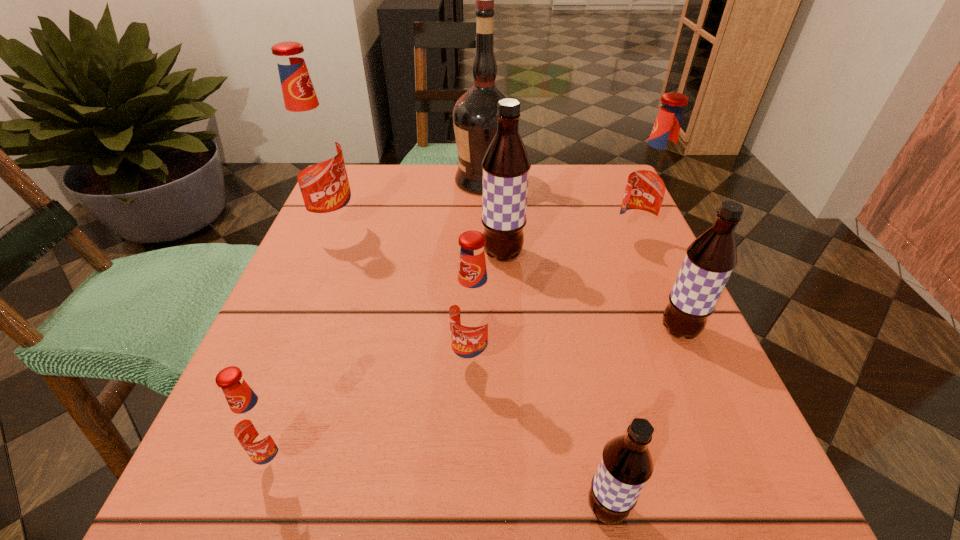
Locate an element on the screen. This screenshot has width=960, height=540. the farthest object is located at coordinates 474,115.

The width and height of the screenshot is (960, 540). What are the coordinates of `the tallest root beer` in the screenshot? It's located at (314, 153).

You are a GUI agent. You are given a task and a screenshot of the screen. Output one action in this format:
    pyautogui.click(x=<x>, y=<y>)
    Task: Click on the third smallest red root beer
    
    Given the screenshot: What is the action you would take?
    pyautogui.click(x=651, y=182)

Where is `the leftmost brown root beer`? the leftmost brown root beer is located at coordinates (506, 165).

The image size is (960, 540). What are the coordinates of `the biggest brown root beer` in the screenshot? It's located at (506, 165).

I want to click on the rightmost brown root beer, so click(710, 259).

Where is `the second smallest brown root beer`? The width and height of the screenshot is (960, 540). the second smallest brown root beer is located at coordinates (710, 259).

Locate an element on the screen. This screenshot has width=960, height=540. the second nearest red root beer is located at coordinates coord(473,309).

Locate an element on the screen. The image size is (960, 540). the second smallest red root beer is located at coordinates (473, 309).

Locate an element on the screen. This screenshot has width=960, height=540. the sixth farthest root beer is located at coordinates (257, 424).